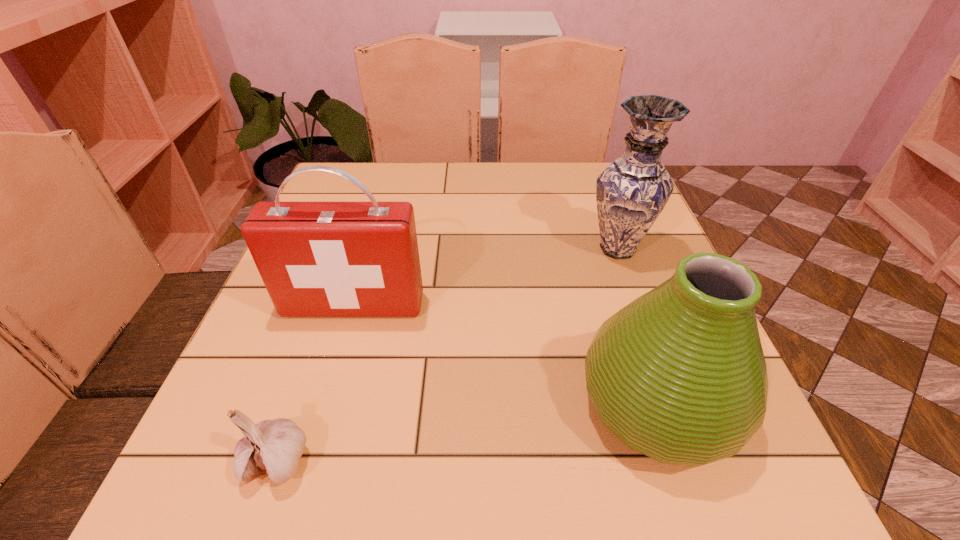
This screenshot has height=540, width=960. I want to click on object that is the third closest to the farther vase, so click(274, 447).

Locate an element on the screen. This screenshot has height=540, width=960. free location that satisfies the following two spatial constraints: 1. on the back side of the farther vase; 2. on the right side of the nearer vase is located at coordinates (607, 249).

Where is `vacant space that satisfies the following two spatial constraints: 1. on the back side of the farther vase; 2. on the right side of the shorter vase`? This screenshot has width=960, height=540. vacant space that satisfies the following two spatial constraints: 1. on the back side of the farther vase; 2. on the right side of the shorter vase is located at coordinates tap(607, 249).

You are a GUI agent. You are given a task and a screenshot of the screen. Output one action in this format:
    pyautogui.click(x=<x>, y=<y>)
    Task: Click on the free space that satisfies the following two spatial constraints: 1. on the back side of the farther vase; 2. on the left side of the shorter vase
    The height and width of the screenshot is (540, 960).
    Given the screenshot: What is the action you would take?
    pyautogui.click(x=607, y=249)

Identify the location of vacant space that satisfies the following two spatial constraints: 1. on the front face of the nearer vase; 2. on the left side of the first-aid kit. (324, 404).